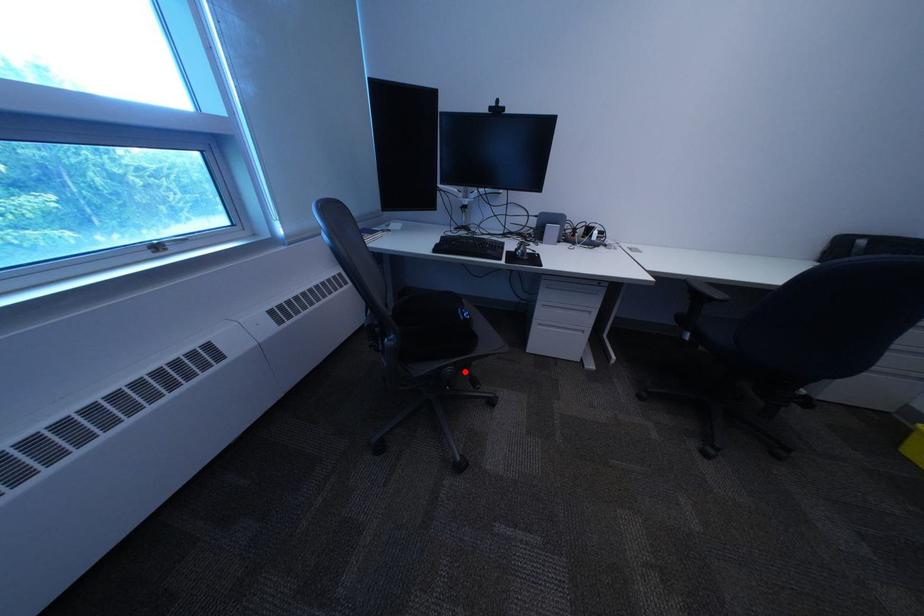
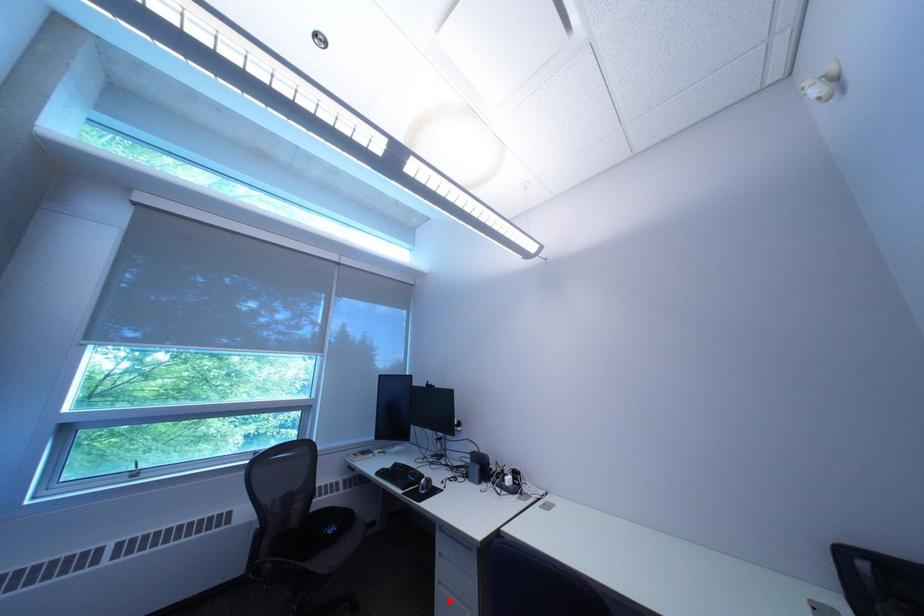
I am providing you with two images of the same scene from different viewpoints. A red point is marked on the first image and another point is marked on the second image. Does the point marked in image1 correspond to the same location as the one in image2?

No